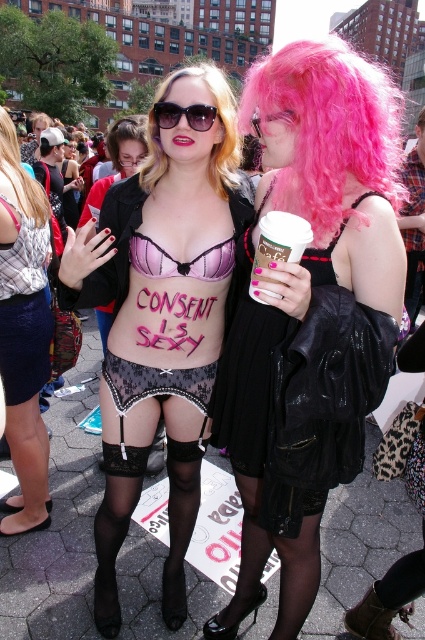
Who is higher up, sunglasses at center or pink synthetic wig at upper center?

pink synthetic wig at upper center is higher up.

How much distance is there between sunglasses at center and pink synthetic wig at upper center?

sunglasses at center and pink synthetic wig at upper center are 2.93 meters apart from each other.

Locate an element on the screen. This screenshot has height=640, width=425. sunglasses at center is located at coordinates (184, 115).

Find the location of a particular element. The height and width of the screenshot is (640, 425). sunglasses at center is located at coordinates (184, 115).

Is matte black shorts at lower left bigger than blondehair at center?

Actually, matte black shorts at lower left might be smaller than blondehair at center.

Which is more to the left, matte black shorts at lower left or blondehair at center?

blondehair at center is more to the left.

I want to click on matte black shorts at lower left, so click(x=23, y=333).

Between point (285, 211) and point (192, 124), which one is positioned in front?

Positioned in front is point (285, 211).

Is point (294, 236) more distant than point (163, 108)?

No.

You are a GUI agent. You are given a task and a screenshot of the screen. Output one action in this format:
    pyautogui.click(x=<x>, y=<y>)
    Task: Click on the white paper cup at center
    This screenshot has height=640, width=425.
    Given the screenshot: What is the action you would take?
    pyautogui.click(x=278, y=243)